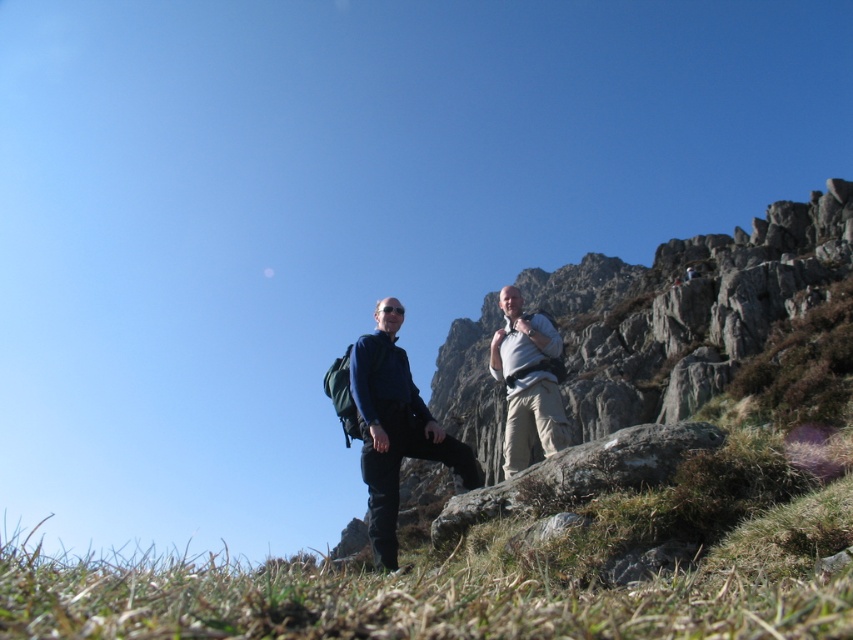
You are planning to take a photo of the rugged stone mountain at right and the dark blue fabric pants at center. Which object should you focus on first if you want to capture both in a single frame without moving the camera?

You should focus on the rugged stone mountain at right first because it is larger in size than the dark blue fabric pants at center, so it will require more attention to detail to ensure it fits properly within the frame.

You are standing at the point marked as point (686, 308) in the image. Looking around, you see rugged stone mountain at right. What direction should you face to see the rugged stone mountain at right?

The rugged stone mountain at right is located to your right side, so you should turn your body to face the right direction to see it.